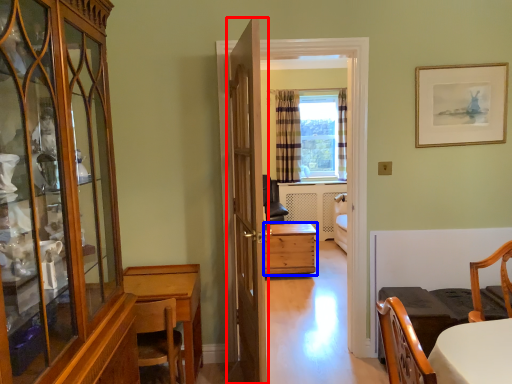
Question: Among these objects, which one is nearest to the camera, door (highlighted by a red box) or desk (highlighted by a blue box)?

Choices:
 (A) door
 (B) desk

Answer: (A)